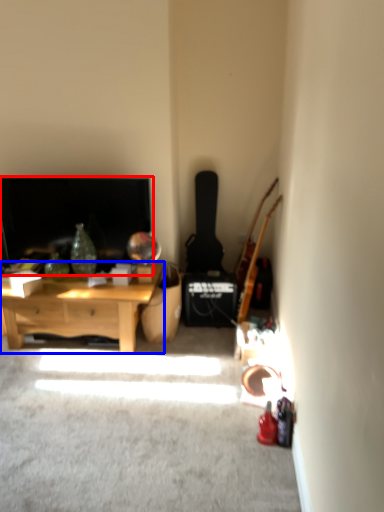
Question: Which point is closer to the camera, fireplace (highlighted by a red box) or desk (highlighted by a blue box)?

Choices:
 (A) fireplace
 (B) desk

Answer: (B)